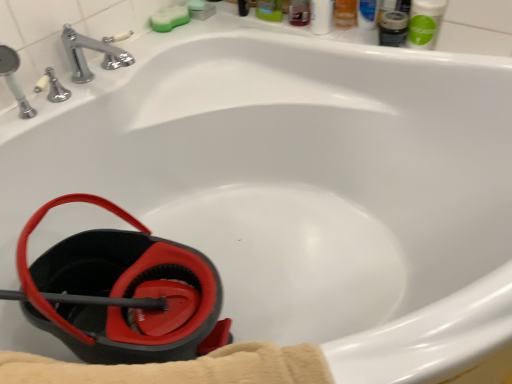
Question: From the image's perspective, would you say matte black mouthwash at upper right, which appears as the first mouthwash when viewed from the left, is shown under green matte mouthwash at upper right, the first mouthwash positioned from the right?

Choices:
 (A) yes
 (B) no

Answer: (A)

Question: From a real-world perspective, is matte black mouthwash at upper right, which appears as the second mouthwash when viewed from the right, located beneath green matte mouthwash at upper right, the first mouthwash positioned from the right?

Choices:
 (A) yes
 (B) no

Answer: (A)

Question: Considering the relative sizes of matte black mouthwash at upper right, which appears as the second mouthwash when viewed from the right, and green matte mouthwash at upper right, the first mouthwash positioned from the right, in the image provided, is matte black mouthwash at upper right, which appears as the second mouthwash when viewed from the right, wider than green matte mouthwash at upper right, the first mouthwash positioned from the right,?

Choices:
 (A) yes
 (B) no

Answer: (B)

Question: Considering the relative sizes of matte black mouthwash at upper right, which appears as the first mouthwash when viewed from the left, and green matte mouthwash at upper right, which is the 2th mouthwash in left-to-right order, in the image provided, is matte black mouthwash at upper right, which appears as the first mouthwash when viewed from the left, shorter than green matte mouthwash at upper right, which is the 2th mouthwash in left-to-right order,?

Choices:
 (A) yes
 (B) no

Answer: (A)

Question: Can you confirm if matte black mouthwash at upper right, which appears as the second mouthwash when viewed from the right, is thinner than green matte mouthwash at upper right, the first mouthwash positioned from the right?

Choices:
 (A) no
 (B) yes

Answer: (B)

Question: From the image's perspective, is green matte mouthwash at upper right, which is the 2th mouthwash in left-to-right order, positioned above or below black rubber bucket at lower left?

Choices:
 (A) above
 (B) below

Answer: (A)

Question: From a real-world perspective, relative to black rubber bucket at lower left, is green matte mouthwash at upper right, which is the 2th mouthwash in left-to-right order, vertically above or below?

Choices:
 (A) above
 (B) below

Answer: (A)

Question: In terms of width, does green matte mouthwash at upper right, the first mouthwash positioned from the right, look wider or thinner when compared to black rubber bucket at lower left?

Choices:
 (A) thin
 (B) wide

Answer: (A)

Question: From their relative heights in the image, would you say green matte mouthwash at upper right, the first mouthwash positioned from the right, is taller or shorter than black rubber bucket at lower left?

Choices:
 (A) tall
 (B) short

Answer: (B)

Question: Is green sponge at upper center spatially inside green matte mouthwash at upper right, which is the 2th mouthwash in left-to-right order, or outside of it?

Choices:
 (A) inside
 (B) outside

Answer: (B)

Question: Considering the positions of green sponge at upper center and green matte mouthwash at upper right, which is the 2th mouthwash in left-to-right order, in the image, is green sponge at upper center taller or shorter than green matte mouthwash at upper right, which is the 2th mouthwash in left-to-right order,?

Choices:
 (A) tall
 (B) short

Answer: (B)

Question: From the image's perspective, is green sponge at upper center above or below green matte mouthwash at upper right, the first mouthwash positioned from the right?

Choices:
 (A) above
 (B) below

Answer: (A)

Question: Is green sponge at upper center in front of or behind green matte mouthwash at upper right, which is the 2th mouthwash in left-to-right order, in the image?

Choices:
 (A) behind
 (B) front

Answer: (A)

Question: Which is correct: green matte mouthwash at upper right, the first mouthwash positioned from the right, is inside matte black mouthwash at upper right, which appears as the second mouthwash when viewed from the right, or outside of it?

Choices:
 (A) outside
 (B) inside

Answer: (A)

Question: Considering the relative positions of green matte mouthwash at upper right, the first mouthwash positioned from the right, and matte black mouthwash at upper right, which appears as the first mouthwash when viewed from the left, in the image provided, is green matte mouthwash at upper right, the first mouthwash positioned from the right, to the left or to the right of matte black mouthwash at upper right, which appears as the first mouthwash when viewed from the left,?

Choices:
 (A) left
 (B) right

Answer: (B)